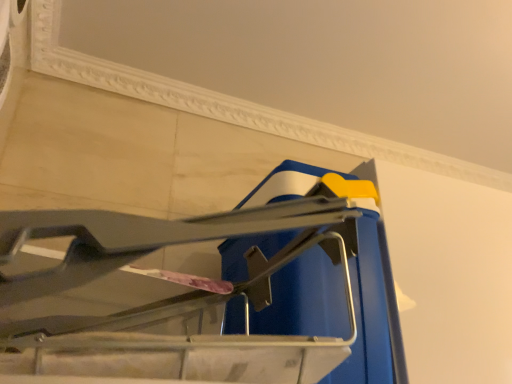
Question: Is white textured wall at upper center oriented away from blue plastic bucket at center?

Choices:
 (A) no
 (B) yes

Answer: (A)

Question: Is white textured wall at upper center in contact with blue plastic bucket at center?

Choices:
 (A) no
 (B) yes

Answer: (A)

Question: Can you confirm if white textured wall at upper center is bigger than blue plastic bucket at center?

Choices:
 (A) yes
 (B) no

Answer: (B)

Question: Can you confirm if white textured wall at upper center is positioned to the right of blue plastic bucket at center?

Choices:
 (A) yes
 (B) no

Answer: (A)

Question: Is white textured wall at upper center thinner than blue plastic bucket at center?

Choices:
 (A) no
 (B) yes

Answer: (A)

Question: Can you confirm if white textured wall at upper center is wider than blue plastic bucket at center?

Choices:
 (A) no
 (B) yes

Answer: (B)

Question: Does blue plastic bucket at center have a greater width compared to white textured wall at upper center?

Choices:
 (A) yes
 (B) no

Answer: (B)

Question: Can you confirm if blue plastic bucket at center is smaller than white textured wall at upper center?

Choices:
 (A) no
 (B) yes

Answer: (A)

Question: Can you confirm if blue plastic bucket at center is positioned to the left of white textured wall at upper center?

Choices:
 (A) yes
 (B) no

Answer: (A)

Question: Can you confirm if blue plastic bucket at center is shorter than white textured wall at upper center?

Choices:
 (A) yes
 (B) no

Answer: (B)

Question: Is the surface of blue plastic bucket at center in direct contact with white textured wall at upper center?

Choices:
 (A) no
 (B) yes

Answer: (A)

Question: Is the depth of blue plastic bucket at center greater than that of white textured wall at upper center?

Choices:
 (A) yes
 (B) no

Answer: (B)

Question: In terms of width, does white textured wall at upper center look wider or thinner when compared to blue plastic bucket at center?

Choices:
 (A) thin
 (B) wide

Answer: (B)